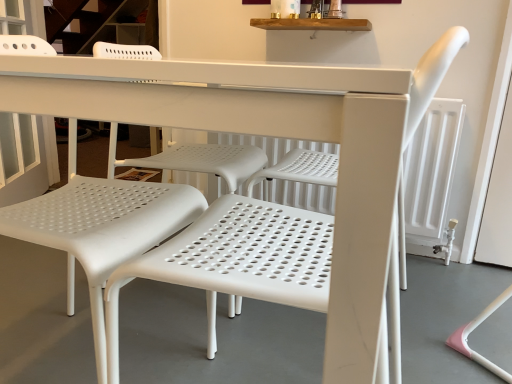
Question: Is white perforated plastic chair at center, acting as the 1th chair starting from the right, shorter than white perforated plastic chair at left, which appears as the 2th chair when viewed from the right?

Choices:
 (A) yes
 (B) no

Answer: (A)

Question: Could you tell me if white perforated plastic chair at center, which ranks as the second chair in left-to-right order, is turned towards white perforated plastic chair at left, which appears as the 2th chair when viewed from the right?

Choices:
 (A) no
 (B) yes

Answer: (B)

Question: Is white perforated plastic chair at center, acting as the 1th chair starting from the right, in contact with white perforated plastic chair at left, which appears as the 2th chair when viewed from the right?

Choices:
 (A) yes
 (B) no

Answer: (B)

Question: Considering the relative sizes of white perforated plastic chair at center, which ranks as the second chair in left-to-right order, and white perforated plastic chair at left, the first chair viewed from the left, in the image provided, is white perforated plastic chair at center, which ranks as the second chair in left-to-right order, thinner than white perforated plastic chair at left, the first chair viewed from the left,?

Choices:
 (A) yes
 (B) no

Answer: (A)

Question: Considering the relative positions of white perforated plastic chair at center, which ranks as the second chair in left-to-right order, and white perforated plastic chair at left, the first chair viewed from the left, in the image provided, is white perforated plastic chair at center, which ranks as the second chair in left-to-right order, to the left of white perforated plastic chair at left, the first chair viewed from the left, from the viewer's perspective?

Choices:
 (A) no
 (B) yes

Answer: (A)

Question: Is white perforated plastic chair at left, the first chair viewed from the left, surrounded by white perforated plastic chair at center, which ranks as the second chair in left-to-right order?

Choices:
 (A) yes
 (B) no

Answer: (B)

Question: Could you tell me if white perforated plastic chair at left, which appears as the 2th chair when viewed from the right, is facing white perforated plastic chair at center, which ranks as the second chair in left-to-right order?

Choices:
 (A) yes
 (B) no

Answer: (A)

Question: Can you confirm if white perforated plastic chair at left, the first chair viewed from the left, is smaller than white perforated plastic chair at center, which ranks as the second chair in left-to-right order?

Choices:
 (A) no
 (B) yes

Answer: (A)

Question: Does white perforated plastic chair at left, the first chair viewed from the left, lie behind white perforated plastic chair at center, acting as the 1th chair starting from the right?

Choices:
 (A) yes
 (B) no

Answer: (A)

Question: Is white perforated plastic chair at left, which appears as the 2th chair when viewed from the right, positioned in front of white perforated plastic chair at center, which ranks as the second chair in left-to-right order?

Choices:
 (A) yes
 (B) no

Answer: (B)

Question: From the image's perspective, is white perforated plastic chair at left, the first chair viewed from the left, located beneath white perforated plastic chair at center, acting as the 1th chair starting from the right?

Choices:
 (A) no
 (B) yes

Answer: (A)

Question: Is white perforated plastic chair at left, which appears as the 2th chair when viewed from the right, positioned with its back to white perforated plastic chair at center, acting as the 1th chair starting from the right?

Choices:
 (A) yes
 (B) no

Answer: (B)

Question: From the image's perspective, relative to white perforated plastic chair at center, acting as the 1th chair starting from the right, is white perforated plastic chair at left, which appears as the 2th chair when viewed from the right, above or below?

Choices:
 (A) below
 (B) above

Answer: (B)